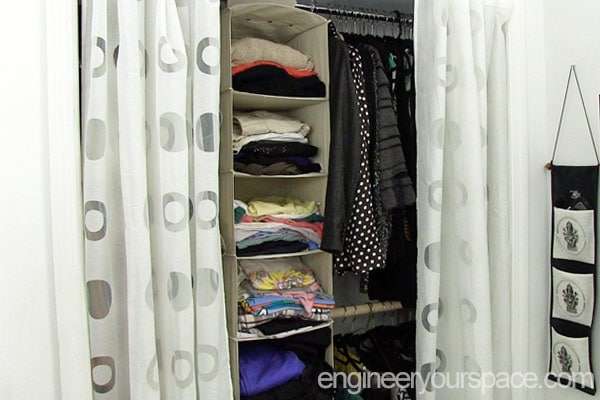
Identify the location of hanging organizer. (291, 137).